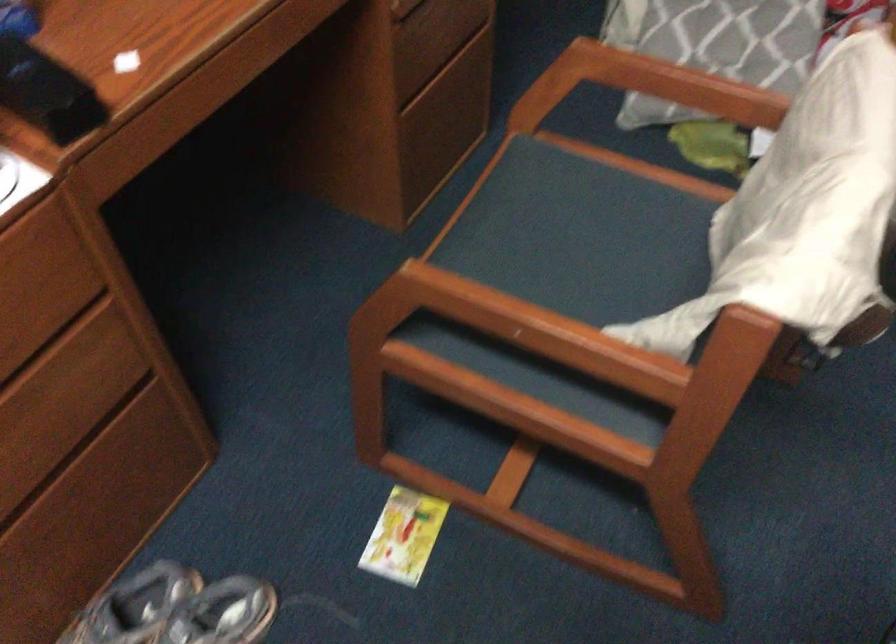
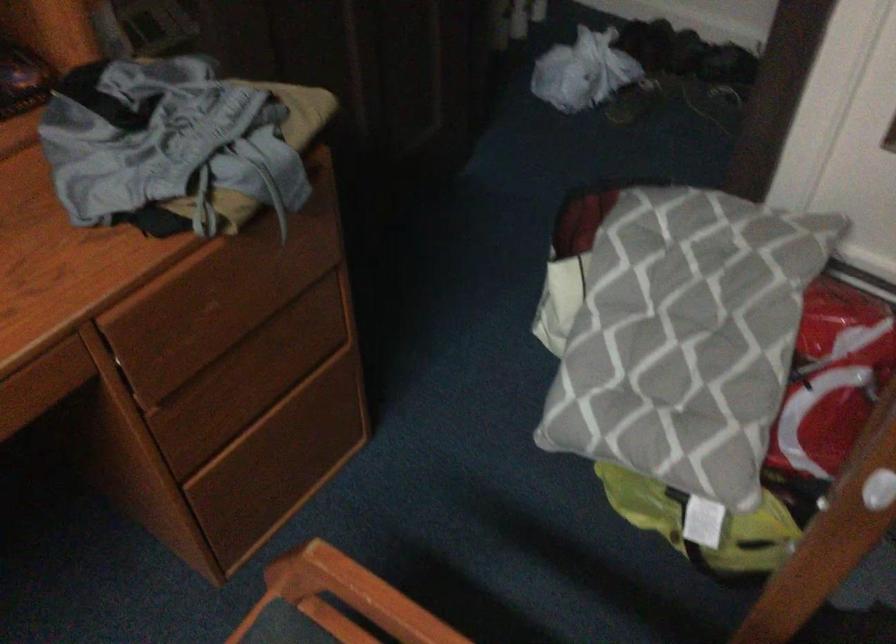
The images are taken continuously from a first-person perspective. In which direction are you moving?

The cameraman moved toward right, forward.